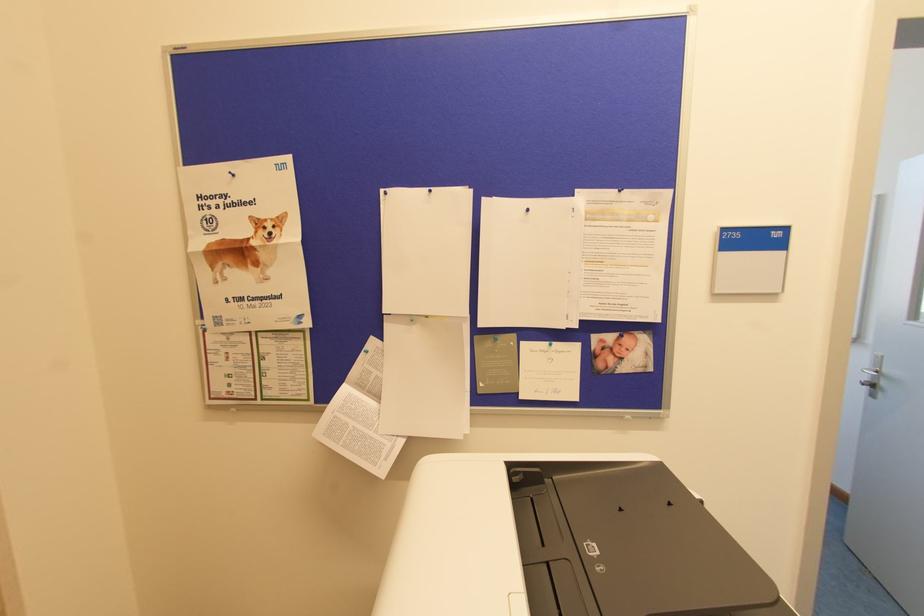
Find where to lift the printer scanner lid. Please return your answer as a coordinate pair (x, y).

(447, 565)